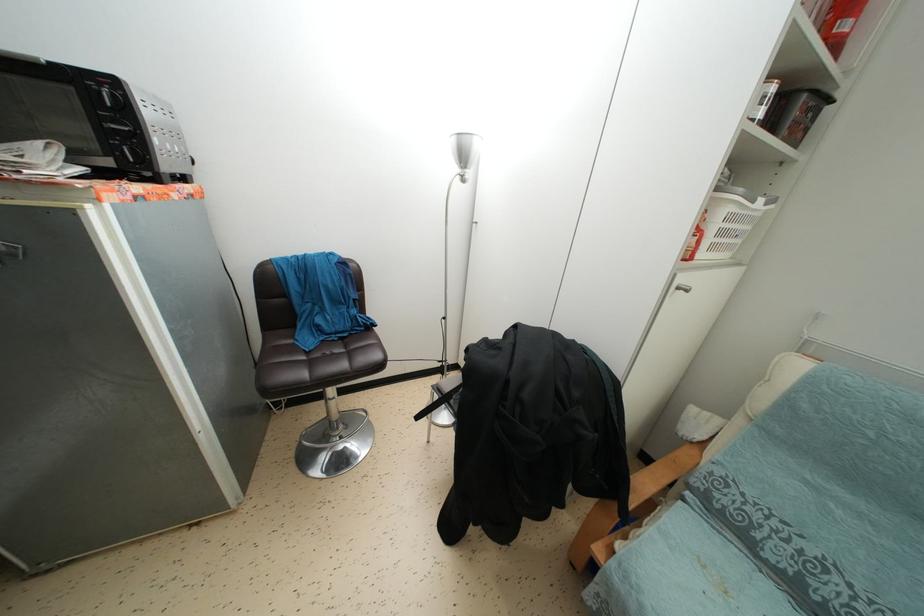
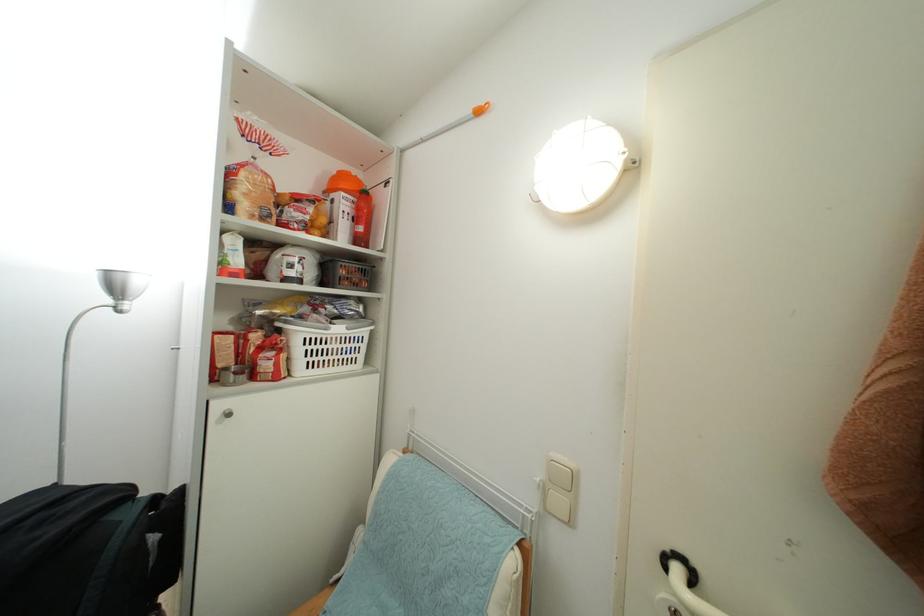
The point at (848, 31) is marked in the first image. Where is the corresponding point in the second image?

(365, 235)